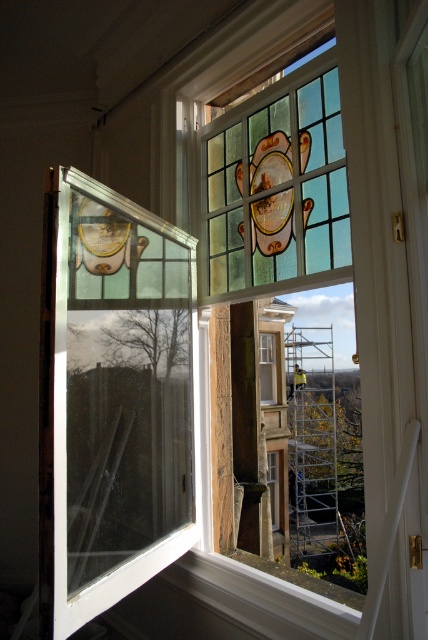
You are a painter standing at the center of the room. You need to paint the silver metallic scaffolding at center and the stained glass window at center. Which one should you paint first if you want to start from the lower part of the window?

The silver metallic scaffolding at center is below the stained glass window at center, so you should paint the silver metallic scaffolding at center first since it is located at the lower part of the window.

You are an architect assessing the structural integrity of the building. You notice the clear glass window at left and the silver metallic scaffolding at center. Which object is shorter in height?

The clear glass window at left has a lesser height compared to the silver metallic scaffolding at center, so the clear glass window at left is shorter in height.